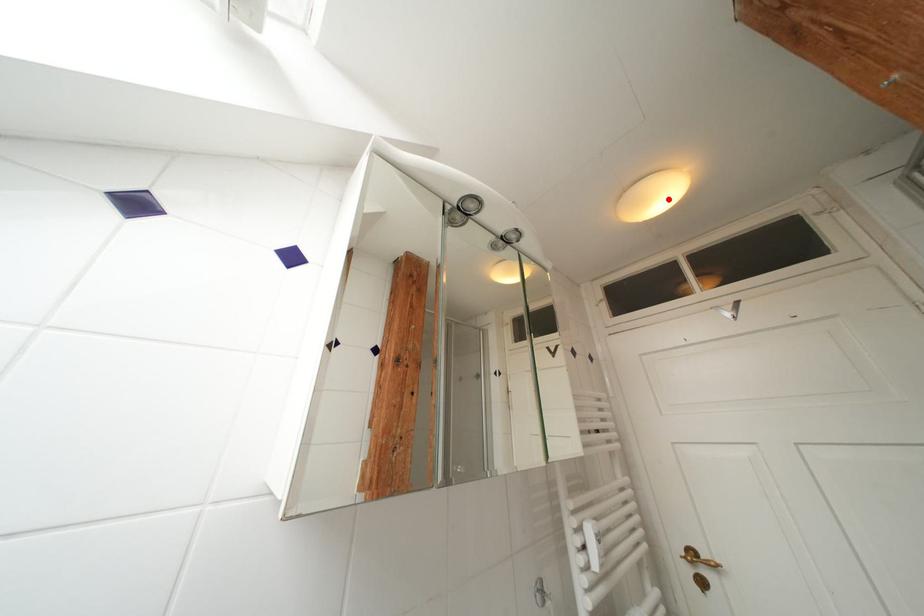
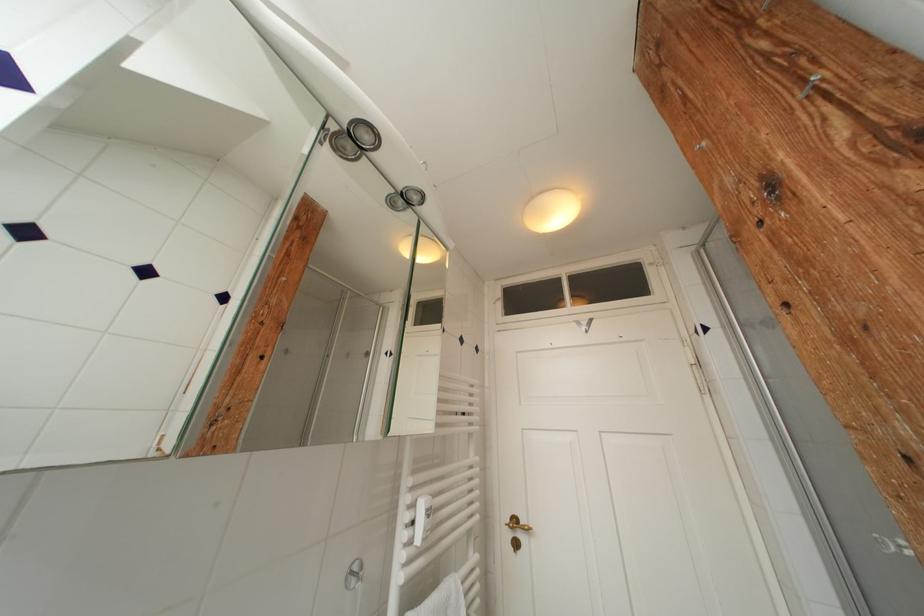
Locate, in the second image, the point that corresponds to the highlighted location in the first image.

(565, 217)